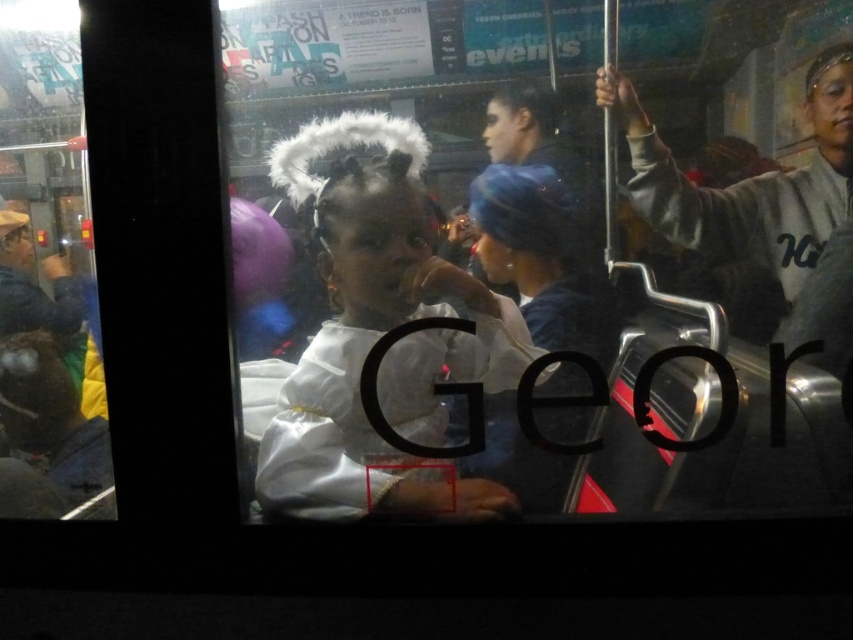
Question: Does white fluffy halo at center appear on the left side of gray fleece jacket at right?

Choices:
 (A) no
 (B) yes

Answer: (B)

Question: Can you confirm if white fluffy halo at center is wider than gray fleece jacket at right?

Choices:
 (A) no
 (B) yes

Answer: (B)

Question: Which of the following is the closest to the observer?

Choices:
 (A) white fluffy halo at center
 (B) gray fleece jacket at right

Answer: (B)

Question: Which point appears closest to the camera in this image?

Choices:
 (A) (846, 141)
 (B) (360, 118)

Answer: (A)

Question: Which point is closer to the camera?

Choices:
 (A) gray fleece jacket at right
 (B) white fluffy halo at center

Answer: (A)

Question: Where is white fluffy halo at center located in relation to gray fleece jacket at right in the image?

Choices:
 (A) right
 (B) left

Answer: (B)